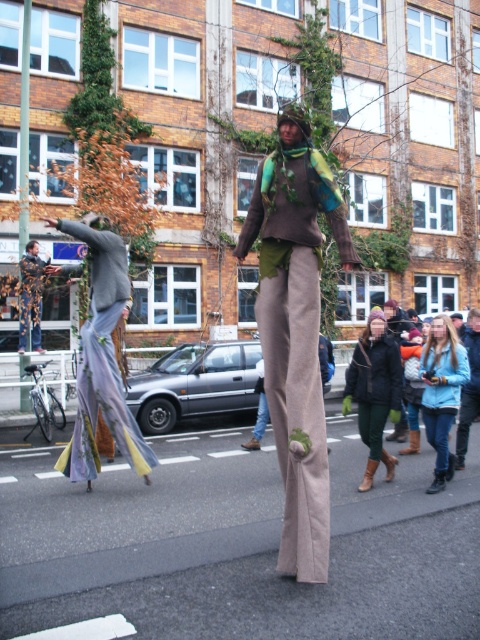
Question: Can you confirm if dark brown leather boots at center is thinner than camouflage fabric man at left?

Choices:
 (A) no
 (B) yes

Answer: (B)

Question: Among these points, which one is farthest from the camera?

Choices:
 (A) (423, 406)
 (B) (392, 358)

Answer: (B)

Question: Which point appears farthest from the camera in this image?

Choices:
 (A) (20, 326)
 (B) (72, 228)
 (C) (442, 392)

Answer: (A)

Question: Does dark brown leather boots at center lie in front of camouflage fabric man at left?

Choices:
 (A) yes
 (B) no

Answer: (A)

Question: Is gray fabric figure at left further to camera compared to dark brown leather boots at center?

Choices:
 (A) yes
 (B) no

Answer: (B)

Question: Which point appears farthest from the camera in this image?

Choices:
 (A) (24, 285)
 (B) (469, 385)
 (C) (92, 378)
 (D) (316, 422)

Answer: (A)